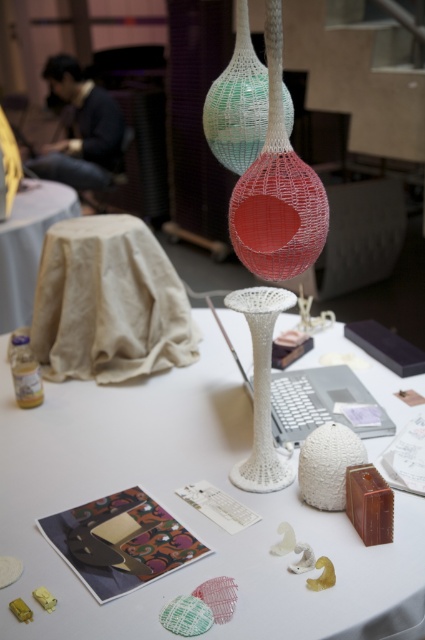
You are an interior designer assessing the placement of the white mesh vase at upper center and the white mesh vase at center. Which one has a larger width?

The white mesh vase at upper center might be wider than the white mesh vase at center.

You are an interior designer working on a project and need to place a 6 inch wide decorative item between the white mesh vase at upper center and the white mesh vase at center. Can you fit it without moving either vase?

The distance between the white mesh vase at upper center and the white mesh vase at center is 7.56 inches. Since the decorative item is 6 inches wide, it can fit within the space between them as 6 inches is less than 7.56 inches.

You are standing in front of the workspace and want to reach a point that is exactly 1 meter away from you. Is the point at coordinate point (252,321) within this distance?

The distance of point (252,321) from viewer is 1.01 meters, so it is slightly beyond the 1 meter mark. You would need to move a bit closer to reach it within the desired distance.